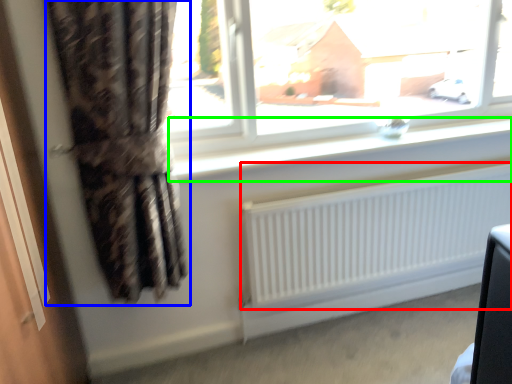
Question: Based on their relative distances, which object is nearer to radiator (highlighted by a red box)? Choose from curtain (highlighted by a blue box) and window sill (highlighted by a green box).

Choices:
 (A) curtain
 (B) window sill

Answer: (B)